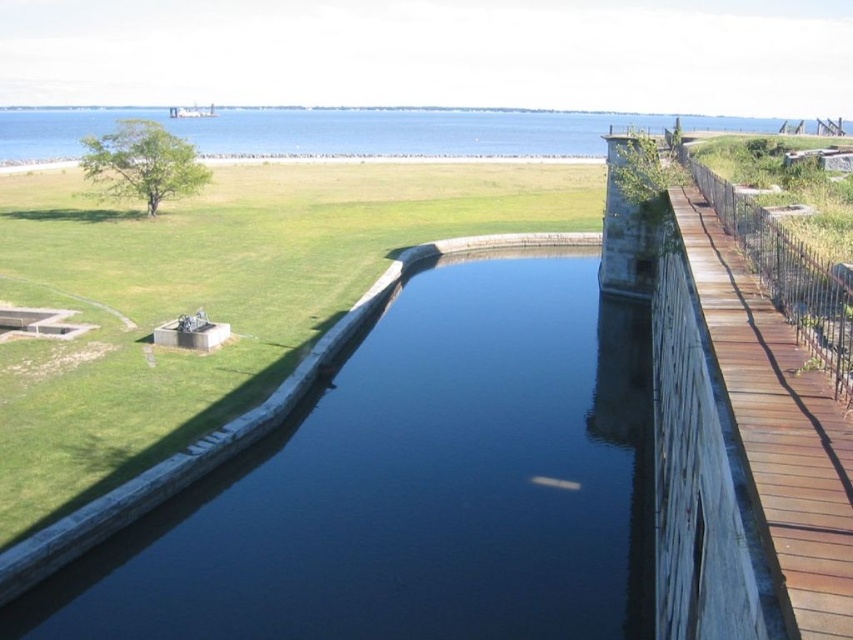
Question: Which object appears farthest from the camera in this image?

Choices:
 (A) blue water at center
 (B) brown wooden rail at right
 (C) dark stone canal at center
 (D) wooden walkway at right

Answer: (A)

Question: Which of the following is the farthest from the observer?

Choices:
 (A) wooden walkway at right
 (B) dark stone canal at center
 (C) brown wooden rail at right
 (D) blue water at center

Answer: (D)

Question: Does wooden walkway at right have a lesser width compared to brown wooden rail at right?

Choices:
 (A) yes
 (B) no

Answer: (A)

Question: Is dark stone canal at center to the left of blue water at center from the viewer's perspective?

Choices:
 (A) no
 (B) yes

Answer: (A)

Question: Does dark stone canal at center lie behind wooden walkway at right?

Choices:
 (A) no
 (B) yes

Answer: (B)

Question: Which object is the farthest from the blue water at center?

Choices:
 (A) wooden walkway at right
 (B) dark stone canal at center
 (C) brown wooden rail at right

Answer: (C)